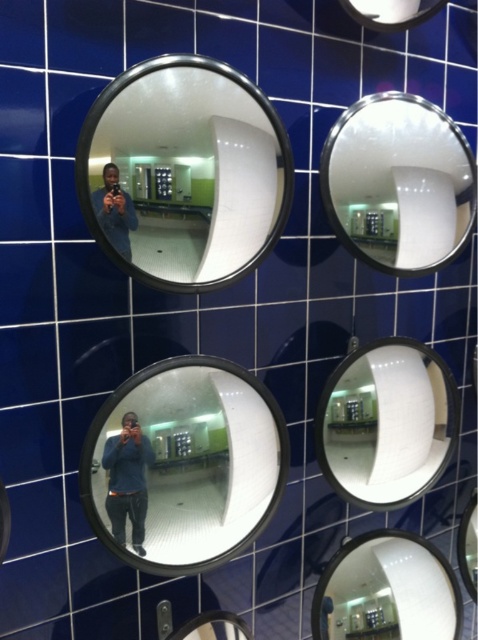
Question: Which object appears farthest from the camera in this image?

Choices:
 (A) clear glass mirror at center
 (B) clear glass mirror at center right
 (C) shiny silver mirror at bottom right
 (D) metallic silver mirror at lower center

Answer: (C)

Question: Can you confirm if silver reflective mirror at upper left is positioned below shiny silver mirror at bottom right?

Choices:
 (A) no
 (B) yes

Answer: (A)

Question: Does dark blue jeans at lower center have a greater width compared to matte black camera at center?

Choices:
 (A) yes
 (B) no

Answer: (A)

Question: Which point is farther to the camera?

Choices:
 (A) (410, 124)
 (B) (195, 372)
 (C) (390, 616)
 (D) (386, 474)

Answer: (C)

Question: Can you confirm if silver reflective mirror at upper right is wider than clear glass mirror at center right?

Choices:
 (A) no
 (B) yes

Answer: (B)

Question: Which object appears farthest from the camera in this image?

Choices:
 (A) dark blue jeans at lower center
 (B) matte black camera at center

Answer: (A)